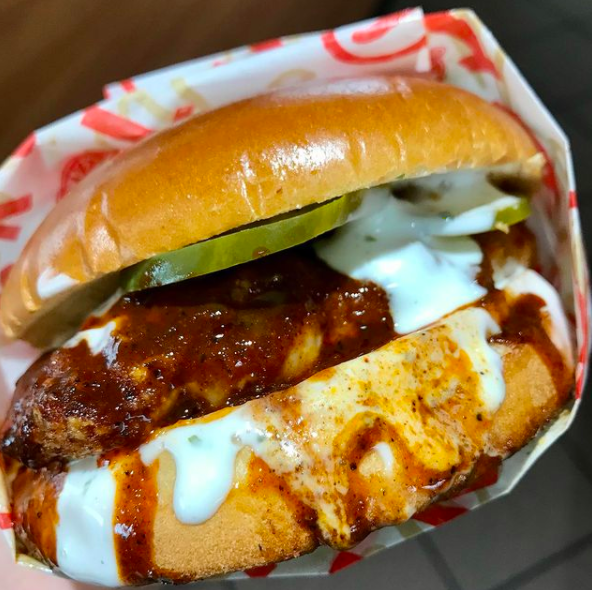
Where is `floor`? The image size is (592, 590). floor is located at coordinates (542, 522).